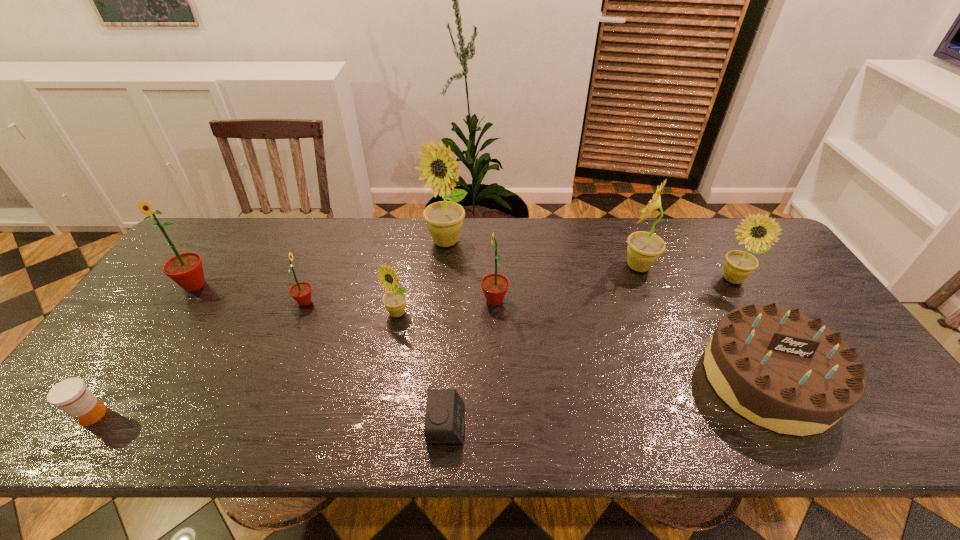
This screenshot has height=540, width=960. What are the coordinates of `object present at the near right corner` in the screenshot? It's located at (783, 371).

You are a GUI agent. You are given a task and a screenshot of the screen. Output one action in this format:
    pyautogui.click(x=<x>, y=<y>)
    Task: Click on the free space at the far edge of the desktop
    
    Given the screenshot: What is the action you would take?
    pyautogui.click(x=664, y=218)

In the image, there is a desktop. Identify the location of vacant space at the near edge. (193, 410).

You are a GUI agent. You are given a task and a screenshot of the screen. Output one action in this format:
    pyautogui.click(x=<x>, y=<y>)
    Task: Click on the free space at the left edge of the desktop
    
    Given the screenshot: What is the action you would take?
    pyautogui.click(x=145, y=316)

The image size is (960, 540). What are the coordinates of `vacant area that lies between the third smallest yellow sunflower and the eighth tallest object` in the screenshot? It's located at (703, 323).

Where is `free spot between the leftmost green sunflower and the second yellow sunflower from right to left`? free spot between the leftmost green sunflower and the second yellow sunflower from right to left is located at coordinates (417, 275).

At what (x,y) coordinates should I click in order to perform the action: click on vacant space that's between the eighth object from right to left and the third shortest object. Please return your answer as a coordinate pair (x, y). This screenshot has width=960, height=540. Looking at the image, I should click on (537, 341).

Find the location of `free point between the third shortest object and the second sunflower from left to right`. free point between the third shortest object and the second sunflower from left to right is located at coordinates (537, 341).

Where is `vacant space that's between the eighth object from right to left and the leftmost sunflower`? The image size is (960, 540). vacant space that's between the eighth object from right to left and the leftmost sunflower is located at coordinates (250, 293).

Where is `free space between the rightmost yellow sunflower and the eighth object from right to left`? free space between the rightmost yellow sunflower and the eighth object from right to left is located at coordinates (518, 291).